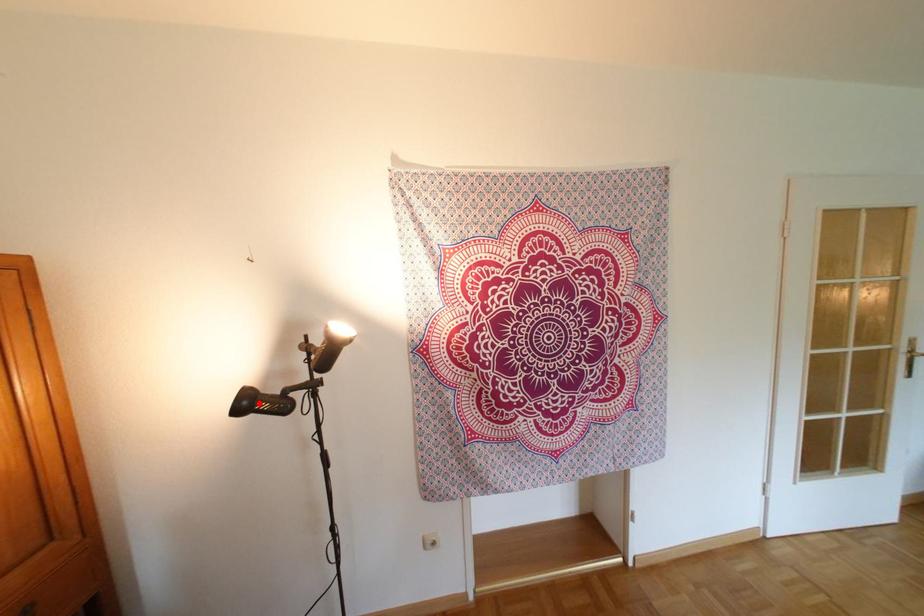
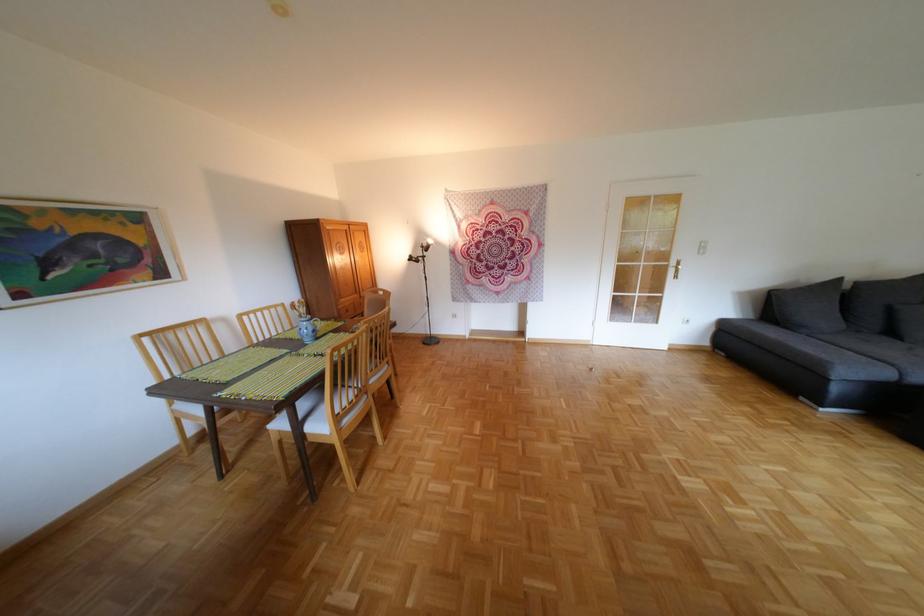
Where in the second image is the point corresponding to the highlighted location from the first image?

(423, 257)